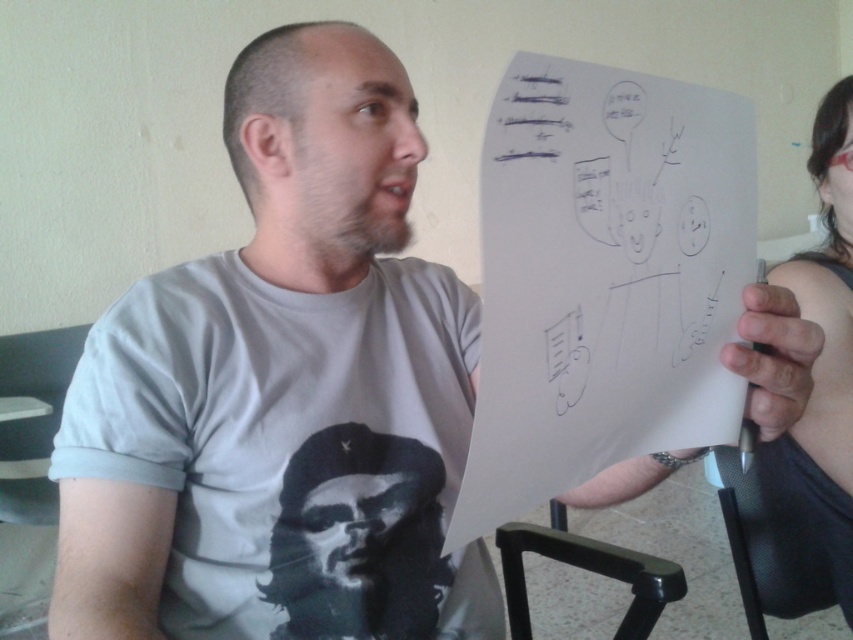
Is the position of smooth skin hand holding whiteboard at right more distant than that of black ink lines at upper center?

Yes, smooth skin hand holding whiteboard at right is further from the viewer.

Identify the location of smooth skin hand holding whiteboard at right. click(819, 387).

Does point (813, 417) come farther from viewer compared to point (556, 156)?

Yes, point (813, 417) is behind point (556, 156).

The width and height of the screenshot is (853, 640). I want to click on smooth skin hand holding whiteboard at right, so click(x=819, y=387).

Is white paper at upper right to the left of smooth skin hand holding whiteboard at right from the viewer's perspective?

Indeed, white paper at upper right is positioned on the left side of smooth skin hand holding whiteboard at right.

Is point (502, 296) positioned in front of point (799, 460)?

Yes.

The width and height of the screenshot is (853, 640). Identify the location of white paper at upper right. (602, 278).

Is white paper at upper right positioned in front of black matte t-shirt at center?

Yes, white paper at upper right is in front of black matte t-shirt at center.

Can you confirm if white paper at upper right is bigger than black matte t-shirt at center?

Yes.

This screenshot has width=853, height=640. What do you see at coordinates (602, 278) in the screenshot?
I see `white paper at upper right` at bounding box center [602, 278].

Find the location of a particular element. white paper at upper right is located at coordinates (602, 278).